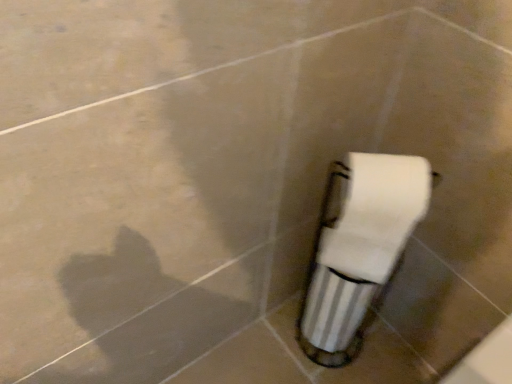
Question: Should I look upward or downward to see white paper at center?

Choices:
 (A) down
 (B) up

Answer: (A)